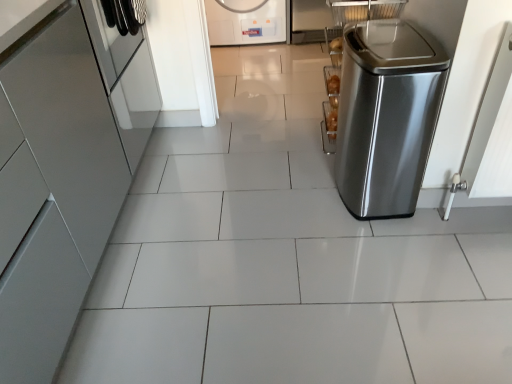
Find the location of a particular element. Image resolution: width=512 pixels, height=384 pixels. free spot to the right of glossy metallic cabinet at left, marked as the 3th home appliance in a right-to-left arrangement is located at coordinates (214, 166).